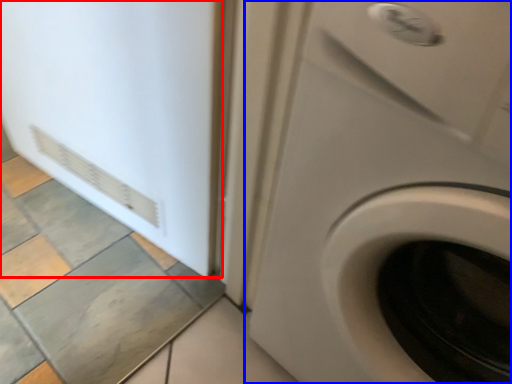
Question: Which object is further to the camera taking this photo, screen door (highlighted by a red box) or washing machine (highlighted by a blue box)?

Choices:
 (A) screen door
 (B) washing machine

Answer: (A)